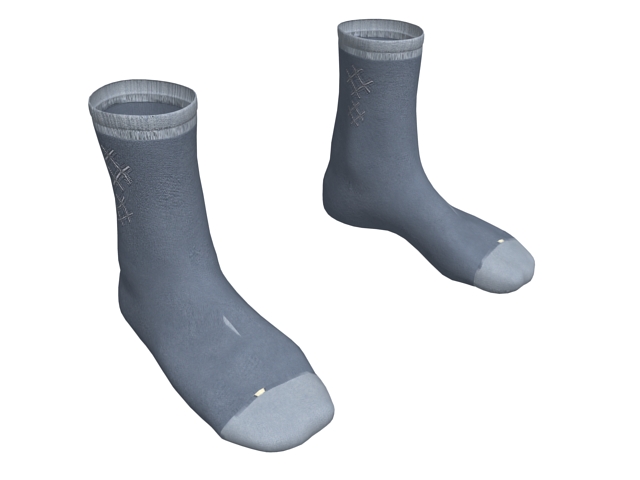
Find the location of a particular element. sock is located at coordinates (198, 268), (396, 158).